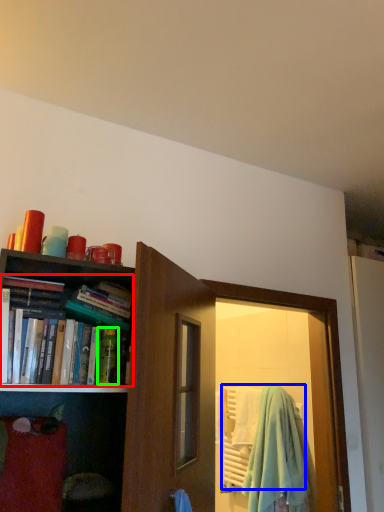
Question: Which object is the farthest from book (highlighted by a red box)? Choose among these: beach towel (highlighted by a blue box) or toiletry (highlighted by a green box).

Choices:
 (A) beach towel
 (B) toiletry

Answer: (A)